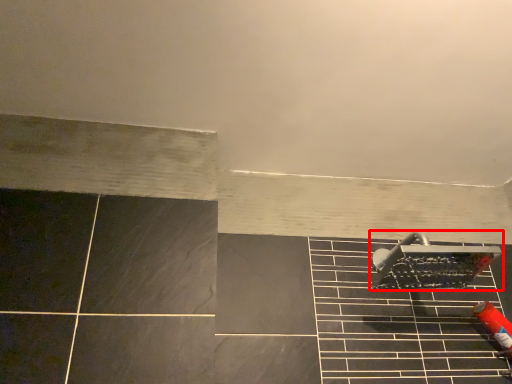
Question: From the image's perspective, where is shower (annotated by the red box) located relative to ceramic tile?

Choices:
 (A) above
 (B) below

Answer: (A)